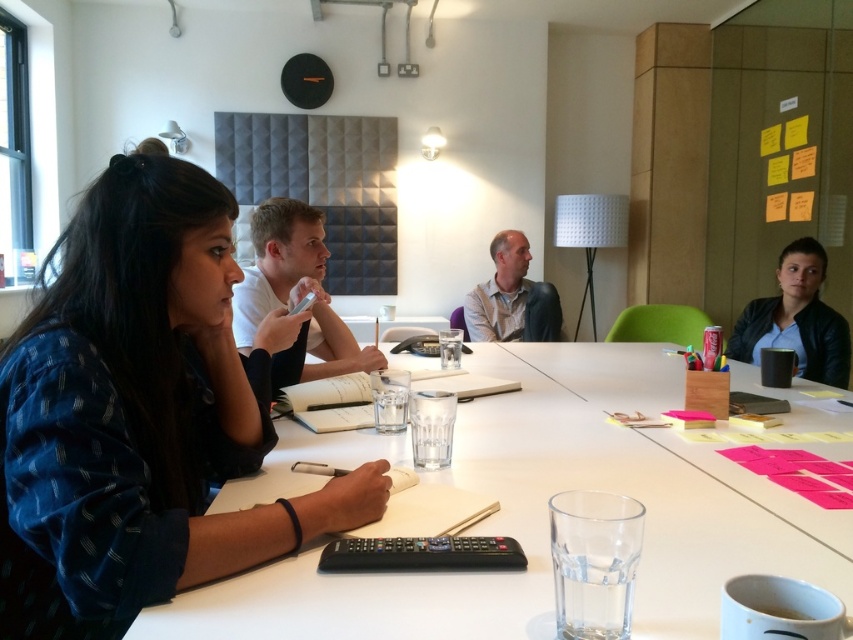
Is blue printed shirt at left thinner than white paper at center?

No, blue printed shirt at left is not thinner than white paper at center.

The height and width of the screenshot is (640, 853). In order to click on blue printed shirt at left in this screenshot , I will do pyautogui.click(x=141, y=413).

How distant is white paper at center from matte black jacket at upper right?

The distance of white paper at center from matte black jacket at upper right is 6.84 feet.

Which is behind, point (349, 369) or point (790, 291)?

Point (790, 291)

Identify the location of white paper at center. The image size is (853, 640). (294, 289).

Who is positioned more to the left, white plastic table at center or light beige shirt at center?

From the viewer's perspective, white plastic table at center appears more on the left side.

Does white plastic table at center have a lesser height compared to light beige shirt at center?

Yes.

Does point (834, 520) come farther from viewer compared to point (477, 289)?

That is False.

You are a GUI agent. You are given a task and a screenshot of the screen. Output one action in this format:
    pyautogui.click(x=<x>, y=<y>)
    Task: Click on the white plastic table at center
    Image resolution: width=853 pixels, height=640 pixels.
    Given the screenshot: What is the action you would take?
    pyautogui.click(x=546, y=516)